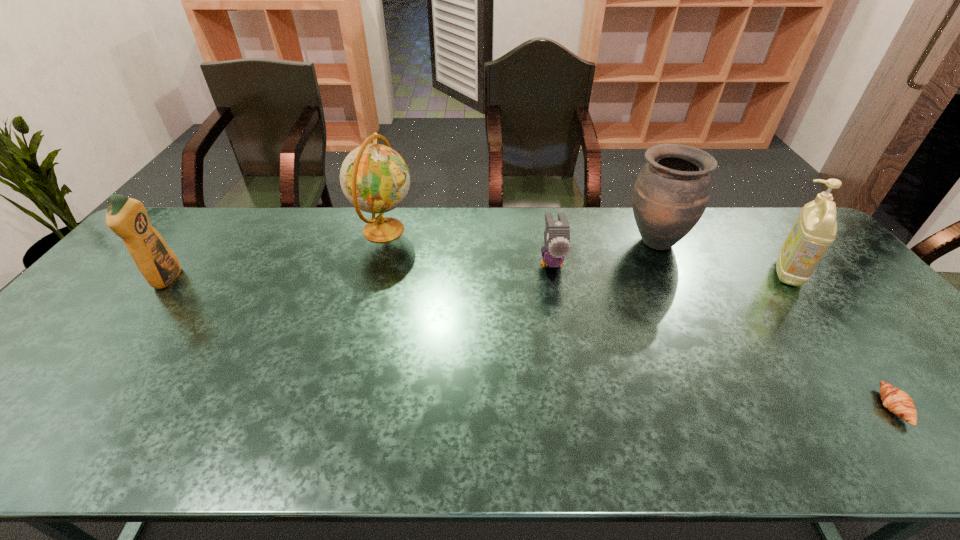
Locate an element on the screen. vacant space located 0.270m on the label of the leftmost object is located at coordinates (271, 279).

At what (x,y) coordinates should I click in order to perform the action: click on vacant space located 0.360m on the front of the right detergent. Please return your answer as a coordinate pair (x, y). Image resolution: width=960 pixels, height=540 pixels. Looking at the image, I should click on (891, 403).

Identify the location of vacant area located 0.250m at the beak of the bird. This screenshot has height=540, width=960. (567, 350).

Locate an element on the screen. vacant area located on the front-facing side of the nearest object is located at coordinates (718, 407).

You are a GUI agent. You are given a task and a screenshot of the screen. Output one action in this format:
    pyautogui.click(x=<x>, y=<y>)
    Task: Click on the free region located on the front-facing side of the nearest object
    The image size is (960, 540).
    Given the screenshot: What is the action you would take?
    pyautogui.click(x=723, y=407)

Locate an element on the screen. The height and width of the screenshot is (540, 960). free region located 0.370m on the front-facing side of the nearest object is located at coordinates (713, 407).

Identify the location of globe present at the far edge. This screenshot has height=540, width=960. (374, 178).

This screenshot has width=960, height=540. I want to click on urn that is at the far edge, so click(x=672, y=190).

At what (x,y) coordinates should I click in order to perform the action: click on bird located in the far edge section of the desktop. Please return your answer as a coordinate pair (x, y). Looking at the image, I should click on (557, 233).

The image size is (960, 540). Find the location of `object positioned at the near edge`. object positioned at the near edge is located at coordinates (897, 401).